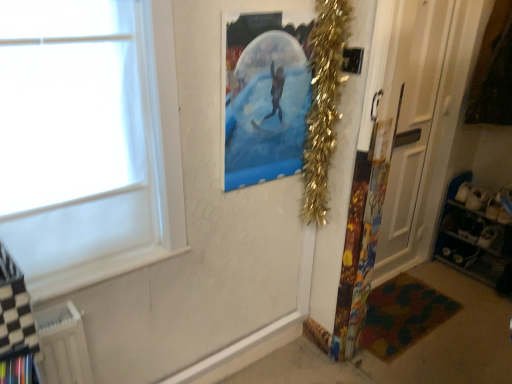
The width and height of the screenshot is (512, 384). In order to click on vacant space in front of multicolored fabric mat at lower right in this screenshot , I will do `click(426, 359)`.